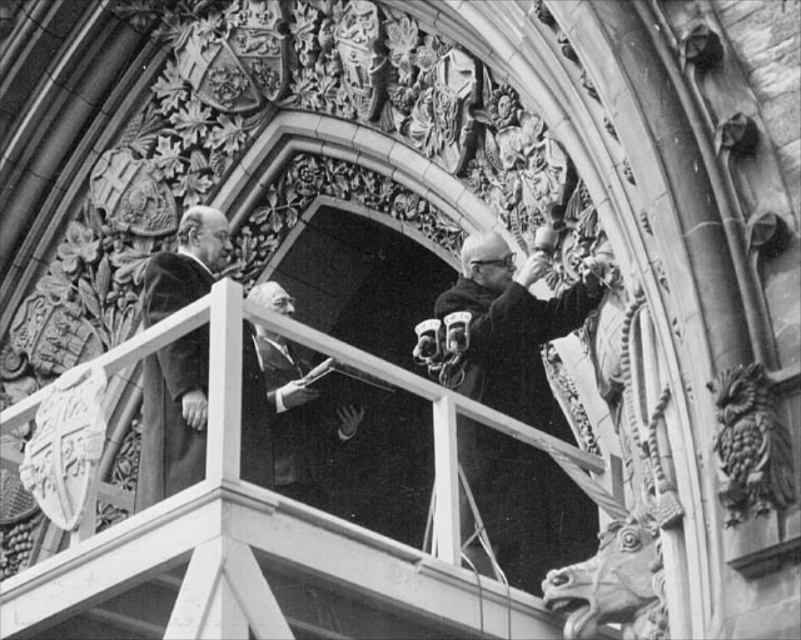
Based on the scene description, which object is taller between the smooth wood balcony at center and the smooth black suit at center?

The smooth wood balcony at center is much taller than the smooth black suit at center.